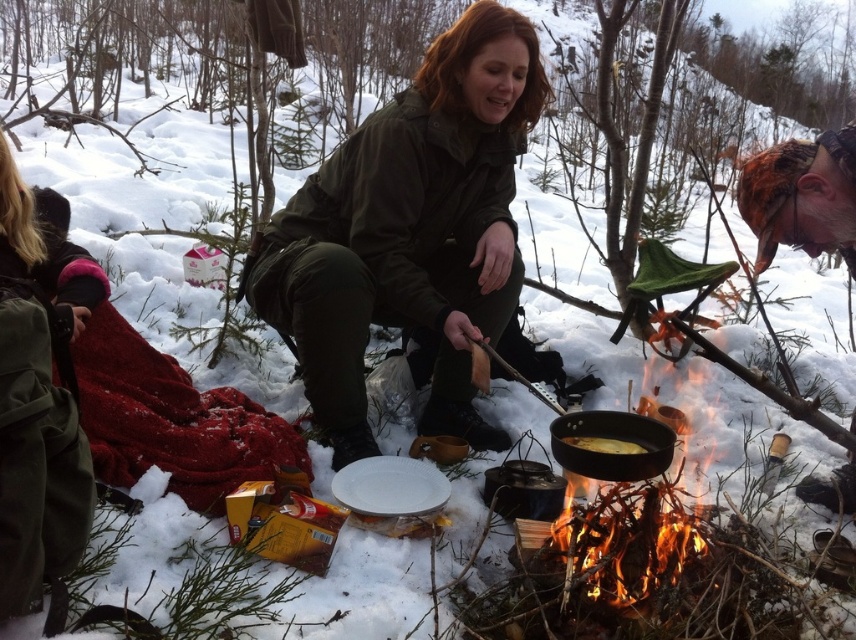
Question: Which object appears closest to the camera in this image?

Choices:
 (A) red woolen blanket at lower left
 (B) golden crispy bread at center

Answer: (B)

Question: Can you confirm if red woolen blanket at lower left is positioned above golden crispy bread at center?

Choices:
 (A) yes
 (B) no

Answer: (A)

Question: Can you confirm if green matte jacket at center is smaller than red woolen blanket at lower left?

Choices:
 (A) no
 (B) yes

Answer: (A)

Question: Estimate the real-world distances between objects in this image. Which object is farther from the green matte jacket at center?

Choices:
 (A) golden crispy bread at center
 (B) red woolen blanket at lower left

Answer: (A)

Question: Which point is closer to the camera taking this photo?

Choices:
 (A) (581, 465)
 (B) (611, 438)
 (C) (287, 304)

Answer: (A)

Question: Can you confirm if green matte jacket at center is positioned above golden crispy bread at center?

Choices:
 (A) yes
 (B) no

Answer: (A)